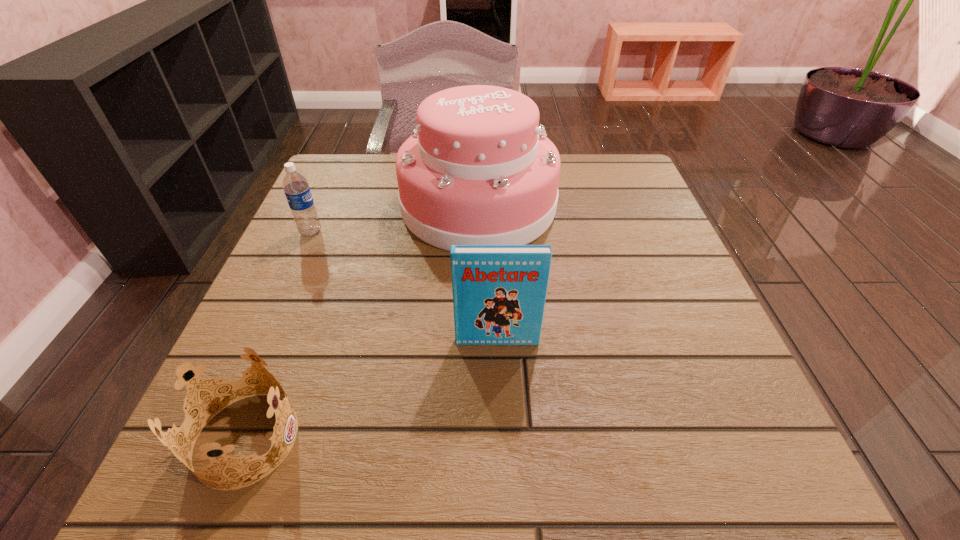
Find the location of a particular element. object situated at the far edge is located at coordinates (478, 170).

At what (x,y) coordinates should I click in order to perform the action: click on object that is at the near edge. Please return your answer as a coordinate pair (x, y). Looking at the image, I should click on (184, 402).

You are a GUI agent. You are given a task and a screenshot of the screen. Output one action in this format:
    pyautogui.click(x=<x>, y=<y>)
    Task: Click on the water bottle located at the left edge
    The height and width of the screenshot is (540, 960).
    Given the screenshot: What is the action you would take?
    point(296,188)

The height and width of the screenshot is (540, 960). Identify the location of crown at the left edge. (184, 402).

Where is `object located at the near left corner`? This screenshot has width=960, height=540. object located at the near left corner is located at coordinates (184, 402).

Where is `vacant space at the far edge of the desktop`? This screenshot has width=960, height=540. vacant space at the far edge of the desktop is located at coordinates (391, 162).

Locate an element on the screen. vacant space at the near edge is located at coordinates (557, 481).

In the image, there is a desktop. Where is `vacant space at the left edge`? This screenshot has height=540, width=960. vacant space at the left edge is located at coordinates (342, 231).

Find the location of a particular element. This screenshot has height=540, width=960. free spot at the right edge of the desktop is located at coordinates click(615, 211).

Identify the location of free space at the far left corner of the desktop. (340, 163).